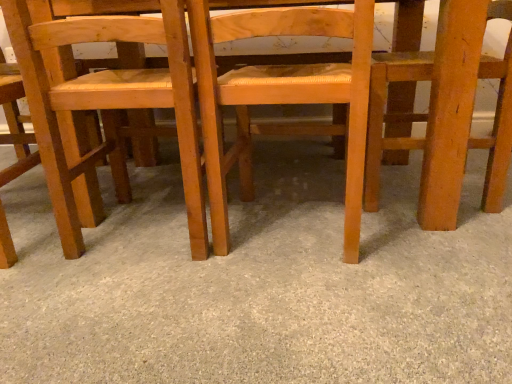
What do you see at coordinates (260, 286) in the screenshot?
I see `smooth beige carpet at center` at bounding box center [260, 286].

Image resolution: width=512 pixels, height=384 pixels. Find the location of `smooth beige carpet at center`. smooth beige carpet at center is located at coordinates (260, 286).

Where is `natural wood chair at center, the 3th chair viewed from the right`? This screenshot has height=384, width=512. natural wood chair at center, the 3th chair viewed from the right is located at coordinates (124, 87).

What is the approximate width of natural wood chair at center, marked as the 2th chair in a left-to-right arrangement?

natural wood chair at center, marked as the 2th chair in a left-to-right arrangement, is 18.80 inches wide.

From the picture: What is the approximate height of wooden chair at right, which appears as the 1th chair when viewed from the right?

wooden chair at right, which appears as the 1th chair when viewed from the right, is 60.87 centimeters tall.

Locate an element on the screen. light brown wood chair at center, which is counted as the third chair, starting from the left is located at coordinates (280, 96).

Which is less distant, [199,237] or [438,86]?

Point [199,237]

Consider the image. Does natural wood chair at center, marked as the 2th chair in a left-to-right arrangement, have a larger size compared to wooden chair at right, which appears as the 1th chair when viewed from the right?

Yes.

Who is more distant, natural wood chair at center, the 3th chair viewed from the right, or wooden chair at right, the fourth chair from the left?

wooden chair at right, the fourth chair from the left, is behind.

Who is taller, natural wood chair at center, marked as the 2th chair in a left-to-right arrangement, or wooden chair at right, the fourth chair from the left?

With more height is natural wood chair at center, marked as the 2th chair in a left-to-right arrangement.

Can we say light brown wood chair at center, which is counted as the third chair, starting from the left, lies outside wooden chair at right, which appears as the 1th chair when viewed from the right?

Absolutely, light brown wood chair at center, which is counted as the third chair, starting from the left, is external to wooden chair at right, which appears as the 1th chair when viewed from the right.

From their relative heights in the image, would you say light brown wood chair at center, which is counted as the third chair, starting from the left, is taller or shorter than wooden chair at right, which appears as the 1th chair when viewed from the right?

In the image, light brown wood chair at center, which is counted as the third chair, starting from the left, appears to be taller than wooden chair at right, which appears as the 1th chair when viewed from the right.

From a real-world perspective, which is physically below, light brown wood chair at center, which appears as the 2th chair when viewed from the right, or wooden chair at right, the fourth chair from the left?

In real-world perspective, light brown wood chair at center, which appears as the 2th chair when viewed from the right, is lower.

Considering their positions, is light brown wood chair at center, which appears as the 2th chair when viewed from the right, located in front of or behind wooden chair at right, which appears as the 1th chair when viewed from the right?

light brown wood chair at center, which appears as the 2th chair when viewed from the right, is in front of wooden chair at right, which appears as the 1th chair when viewed from the right.

From a real-world perspective, between wooden chair at right, which appears as the 1th chair when viewed from the right, and light brown wood chair at left, positioned as the first chair in left-to-right order, who is vertically lower?

light brown wood chair at left, positioned as the first chair in left-to-right order, is physically lower.

Is light brown wood chair at left, positioned as the first chair in left-to-right order, at the back of wooden chair at right, the fourth chair from the left?

No, wooden chair at right, the fourth chair from the left, is not facing the opposite direction of light brown wood chair at left, positioned as the first chair in left-to-right order.

Visually, is wooden chair at right, the fourth chair from the left, positioned to the left or to the right of light brown wood chair at left, the 4th chair viewed from the right?

In the image, wooden chair at right, the fourth chair from the left, appears on the right side of light brown wood chair at left, the 4th chair viewed from the right.

This screenshot has height=384, width=512. In order to click on the 1st chair below the natural wood chair at center, the 3th chair viewed from the right (from a real-world perspective) in this screenshot , I will do `click(446, 112)`.

Is wooden chair at right, the fourth chair from the left, positioned beyond the bounds of natural wood chair at center, the 3th chair viewed from the right?

wooden chair at right, the fourth chair from the left, is positioned outside natural wood chair at center, the 3th chair viewed from the right.

Is wooden chair at right, which appears as the 1th chair when viewed from the right, to the left or to the right of natural wood chair at center, marked as the 2th chair in a left-to-right arrangement, in the image?

From the image, it's evident that wooden chair at right, which appears as the 1th chair when viewed from the right, is to the right of natural wood chair at center, marked as the 2th chair in a left-to-right arrangement.

Is wooden chair at right, the fourth chair from the left, positioned in front of natural wood chair at center, the 3th chair viewed from the right?

That is False.

Which object is positioned more to the left, wooden chair at right, which appears as the 1th chair when viewed from the right, or light brown wood chair at center, which is counted as the third chair, starting from the left?

light brown wood chair at center, which is counted as the third chair, starting from the left, is more to the left.

From the image's perspective, which object appears higher, wooden chair at right, which appears as the 1th chair when viewed from the right, or light brown wood chair at center, which appears as the 2th chair when viewed from the right?

wooden chair at right, which appears as the 1th chair when viewed from the right.

Find the location of a particular element. The image size is (512, 384). the 3rd chair in front of the wooden chair at right, which appears as the 1th chair when viewed from the right is located at coordinates (280, 96).

From the image's perspective, which is above, natural wood chair at center, marked as the 2th chair in a left-to-right arrangement, or smooth beige carpet at center?

natural wood chair at center, marked as the 2th chair in a left-to-right arrangement, is shown above in the image.

In terms of size, does natural wood chair at center, the 3th chair viewed from the right, appear bigger or smaller than smooth beige carpet at center?

Considering their sizes, natural wood chair at center, the 3th chair viewed from the right, takes up less space than smooth beige carpet at center.

Based on the photo, which of these two, natural wood chair at center, the 3th chair viewed from the right, or smooth beige carpet at center, is wider?

With larger width is smooth beige carpet at center.

From the smooth beige carpet at center, count 2nd chairs backward and point to it. Please provide its 2D coordinates.

[(124, 87)]

Is light brown wood chair at center, which appears as the 2th chair when viewed from the right, smaller than light brown wood chair at left, positioned as the first chair in left-to-right order?

Incorrect, light brown wood chair at center, which appears as the 2th chair when viewed from the right, is not smaller in size than light brown wood chair at left, positioned as the first chair in left-to-right order.

Between light brown wood chair at center, which appears as the 2th chair when viewed from the right, and light brown wood chair at left, positioned as the first chair in left-to-right order, which one appears on the left side from the viewer's perspective?

From the viewer's perspective, light brown wood chair at left, positioned as the first chair in left-to-right order, appears more on the left side.

In the scene shown: Which object is wider, light brown wood chair at center, which is counted as the third chair, starting from the left, or light brown wood chair at left, the 4th chair viewed from the right?

light brown wood chair at center, which is counted as the third chair, starting from the left, is wider.

Is light brown wood chair at center, which appears as the 2th chair when viewed from the right, positioned beyond the bounds of light brown wood chair at left, positioned as the first chair in left-to-right order?

light brown wood chair at center, which appears as the 2th chair when viewed from the right, is positioned outside light brown wood chair at left, positioned as the first chair in left-to-right order.

The width and height of the screenshot is (512, 384). In order to click on the 1st chair positioned below the natural wood chair at center, the 3th chair viewed from the right (from a real-world perspective) in this screenshot , I will do (x=446, y=112).

Image resolution: width=512 pixels, height=384 pixels. I want to click on the 1st chair counting from the left side of the wooden chair at right, the fourth chair from the left, so click(x=280, y=96).

Looking at the image, which one is located further to light brown wood chair at left, the 4th chair viewed from the right, natural wood chair at center, the 3th chair viewed from the right, or light brown wood chair at center, which is counted as the third chair, starting from the left?

Based on the image, light brown wood chair at center, which is counted as the third chair, starting from the left, appears to be further to light brown wood chair at left, the 4th chair viewed from the right.

When comparing their distances from light brown wood chair at left, the 4th chair viewed from the right, does smooth beige carpet at center or wooden chair at right, which appears as the 1th chair when viewed from the right, seem closer?

smooth beige carpet at center is closer to light brown wood chair at left, the 4th chair viewed from the right.

Looking at this image, which object lies nearer to the anchor point natural wood chair at center, the 3th chair viewed from the right, light brown wood chair at left, positioned as the first chair in left-to-right order, or light brown wood chair at center, which appears as the 2th chair when viewed from the right?

light brown wood chair at center, which appears as the 2th chair when viewed from the right, lies closer to natural wood chair at center, the 3th chair viewed from the right, than the other object.

Which object lies nearer to the anchor point natural wood chair at center, the 3th chair viewed from the right, wooden chair at right, which appears as the 1th chair when viewed from the right, or smooth beige carpet at center?

smooth beige carpet at center.

Looking at the image, which one is located closer to smooth beige carpet at center, natural wood chair at center, the 3th chair viewed from the right, or wooden chair at right, which appears as the 1th chair when viewed from the right?

natural wood chair at center, the 3th chair viewed from the right, is closer to smooth beige carpet at center.

From the image, which object appears to be nearer to natural wood chair at center, the 3th chair viewed from the right, wooden chair at right, which appears as the 1th chair when viewed from the right, or light brown wood chair at left, positioned as the first chair in left-to-right order?

Based on the image, light brown wood chair at left, positioned as the first chair in left-to-right order, appears to be nearer to natural wood chair at center, the 3th chair viewed from the right.

From the image, which object appears to be nearer to light brown wood chair at center, which appears as the 2th chair when viewed from the right, wooden chair at right, which appears as the 1th chair when viewed from the right, or natural wood chair at center, the 3th chair viewed from the right?

natural wood chair at center, the 3th chair viewed from the right, lies closer to light brown wood chair at center, which appears as the 2th chair when viewed from the right, than the other object.

Estimate the real-world distances between objects in this image. Which object is further from smooth beige carpet at center, light brown wood chair at center, which is counted as the third chair, starting from the left, or light brown wood chair at left, the 4th chair viewed from the right?

The object further to smooth beige carpet at center is light brown wood chair at left, the 4th chair viewed from the right.

Where is `chair between light brown wood chair at left, positioned as the first chair in left-to-right order, and smooth beige carpet at center, in the horizontal direction`? The image size is (512, 384). chair between light brown wood chair at left, positioned as the first chair in left-to-right order, and smooth beige carpet at center, in the horizontal direction is located at coordinates (124, 87).

Locate an element on the screen. The image size is (512, 384). chair located between natural wood chair at center, marked as the 2th chair in a left-to-right arrangement, and wooden chair at right, which appears as the 1th chair when viewed from the right, in the left-right direction is located at coordinates (280, 96).

Locate an element on the screen. The height and width of the screenshot is (384, 512). chair between smooth beige carpet at center and wooden chair at right, the fourth chair from the left is located at coordinates (280, 96).

Where is `chair between light brown wood chair at left, the 4th chair viewed from the right, and light brown wood chair at center, which appears as the 2th chair when viewed from the right, in the horizontal direction`? chair between light brown wood chair at left, the 4th chair viewed from the right, and light brown wood chair at center, which appears as the 2th chair when viewed from the right, in the horizontal direction is located at coordinates (124, 87).